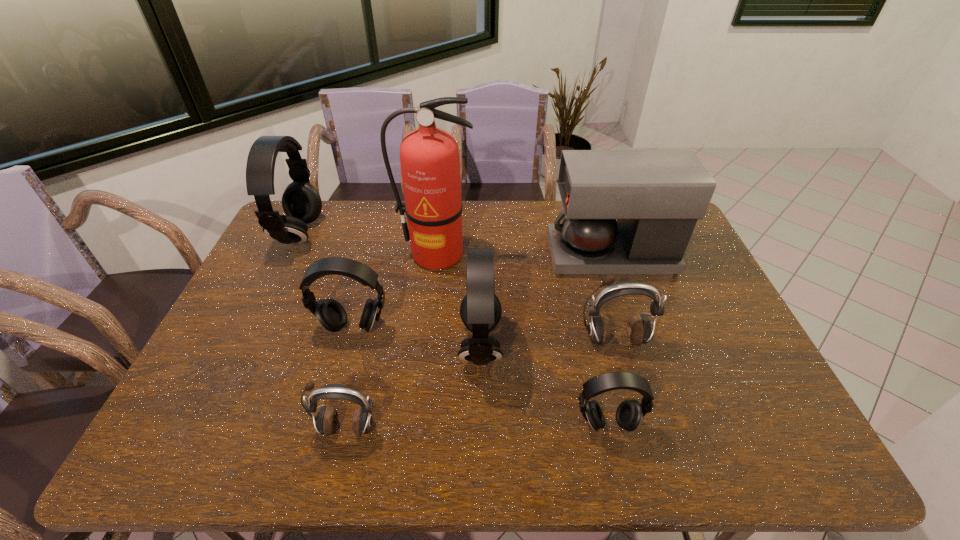
This screenshot has width=960, height=540. I want to click on blank region between the smallest black earphone and the coffee maker, so click(x=609, y=340).

The height and width of the screenshot is (540, 960). I want to click on unoccupied area between the second smallest black earphone and the tallest earphone, so click(x=326, y=281).

Find the location of a particular element. The height and width of the screenshot is (540, 960). blank region between the third smallest black earphone and the red fire extinguisher is located at coordinates (459, 300).

This screenshot has width=960, height=540. Find the location of `unoccupied area between the smallest black earphone and the left brown earphone`. unoccupied area between the smallest black earphone and the left brown earphone is located at coordinates (476, 426).

Locate an element on the screen. The image size is (960, 540). unoccupied position between the second smallest black earphone and the biggest black earphone is located at coordinates (326, 281).

Find the location of a particular element. The height and width of the screenshot is (540, 960). object that is the third closest to the coffee maker is located at coordinates (429, 157).

Where is `object identified as the third closest to the second biggest black earphone`? The width and height of the screenshot is (960, 540). object identified as the third closest to the second biggest black earphone is located at coordinates (326, 421).

Find the location of `the fourth closest earphone to the second biggest black earphone`. the fourth closest earphone to the second biggest black earphone is located at coordinates point(639,331).

Identify the location of earphone that is the sixth nearest to the coffee maker. This screenshot has width=960, height=540. (301, 202).

Where is `black earphone that stands as the fourth closest to the fire extinguisher`? Image resolution: width=960 pixels, height=540 pixels. black earphone that stands as the fourth closest to the fire extinguisher is located at coordinates (629, 413).